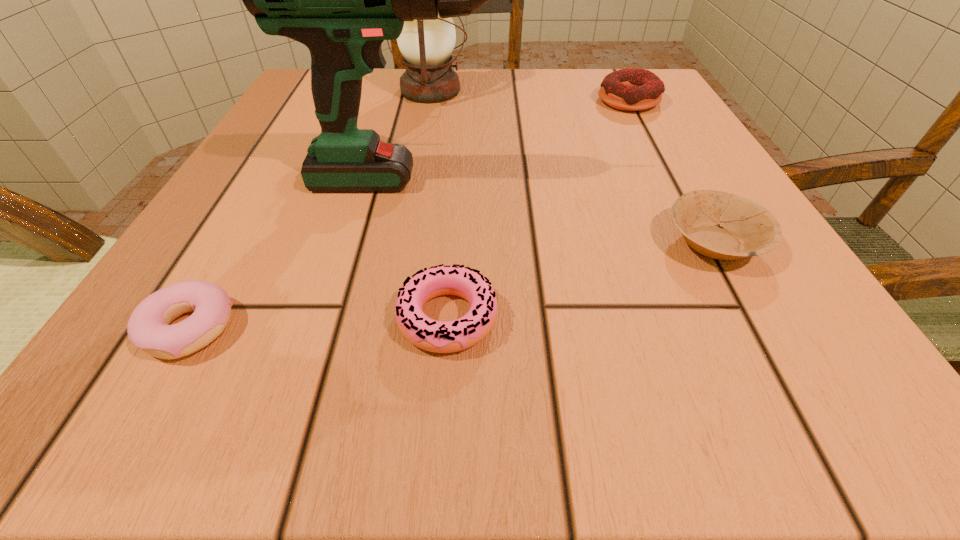
Where is `vacant area that lies between the second doughnut from right to left and the fourth shortest object`? The image size is (960, 540). vacant area that lies between the second doughnut from right to left and the fourth shortest object is located at coordinates (538, 210).

Where is `free spot between the drill and the leftmost object`? free spot between the drill and the leftmost object is located at coordinates (305, 255).

Find the location of `free space between the second doughnut from right to left and the oil lamp`. free space between the second doughnut from right to left and the oil lamp is located at coordinates (439, 204).

The height and width of the screenshot is (540, 960). What are the coordinates of `vacant space in between the leftmost doughnut and the oil lamp` in the screenshot? It's located at pyautogui.click(x=311, y=210).

Where is `free spot between the drill and the second doughnut from left to right`? This screenshot has width=960, height=540. free spot between the drill and the second doughnut from left to right is located at coordinates (434, 249).

Locate which object is the fifth closest to the second doughnut from left to right. Please provide its 2D coordinates. Your answer should be formatted as a tuple, i.e. [(x, y)], where the tuple contains the x and y coordinates of a point satisfying the conditions above.

[(629, 89)]

Locate which object ranks fifth in proximity to the third farthest object. Please provide its 2D coordinates. Your answer should be formatted as a tuple, i.e. [(x, y)], where the tuple contains the x and y coordinates of a point satisfying the conditions above.

[(629, 89)]

The height and width of the screenshot is (540, 960). In order to click on doughnut that is the second closest one to the third tallest object in this screenshot , I will do `click(148, 328)`.

I want to click on doughnut identified as the second closest to the fourth farthest object, so click(x=629, y=89).

You are a GUI agent. You are given a task and a screenshot of the screen. Output one action in this format:
    pyautogui.click(x=<x>, y=<y>)
    Task: Click on the free space that satisfies the following two spatial constraints: 1. on the handle side of the second doughnut from left to right; 2. on the left side of the drill
    Image resolution: width=960 pixels, height=540 pixels.
    Given the screenshot: What is the action you would take?
    pyautogui.click(x=397, y=318)